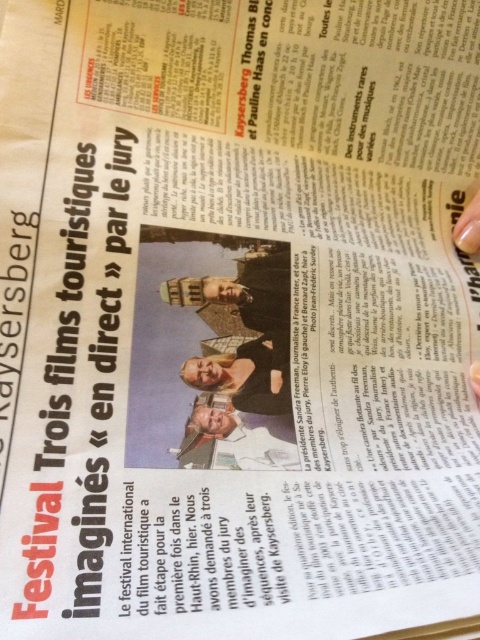
You are a journalist reviewing this newspaper article. You notice the matte brown statue at center and the nail polish at upper right in the image. Which object is located more to the left?

The matte brown statue at center is positioned on the left side of nail polish at upper right, so it is more to the left.

You are a photographer reviewing the image of the French newspaper article. You notice a point marked at coordinates [236,436]. What object is located at this point?

The point at [236,436] has the matte white face at center.

You are a photographer standing at the bottom of the stairs leading to the newspaper article. You need to take a photo of the matte brown statue at center without moving your position. Can you fit both the statue and the three smiling individuals in the frame if your camera has a standard 50mm lens?

The three smiling individuals and the matte brown statue at center are 30.65 inches apart. With a standard 50mm lens, this distance can be captured in a single frame without needing to move your position.